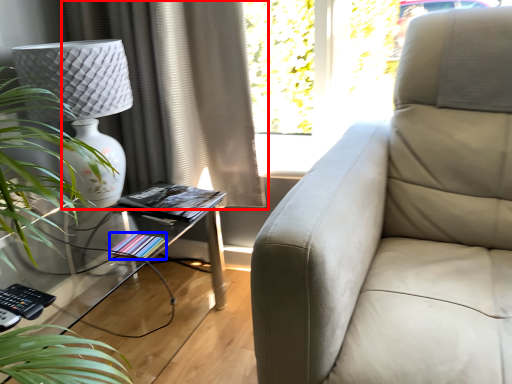
Question: Which object appears farthest to the camera in this image, curtain (highlighted by a red box) or book (highlighted by a blue box)?

Choices:
 (A) curtain
 (B) book

Answer: (A)